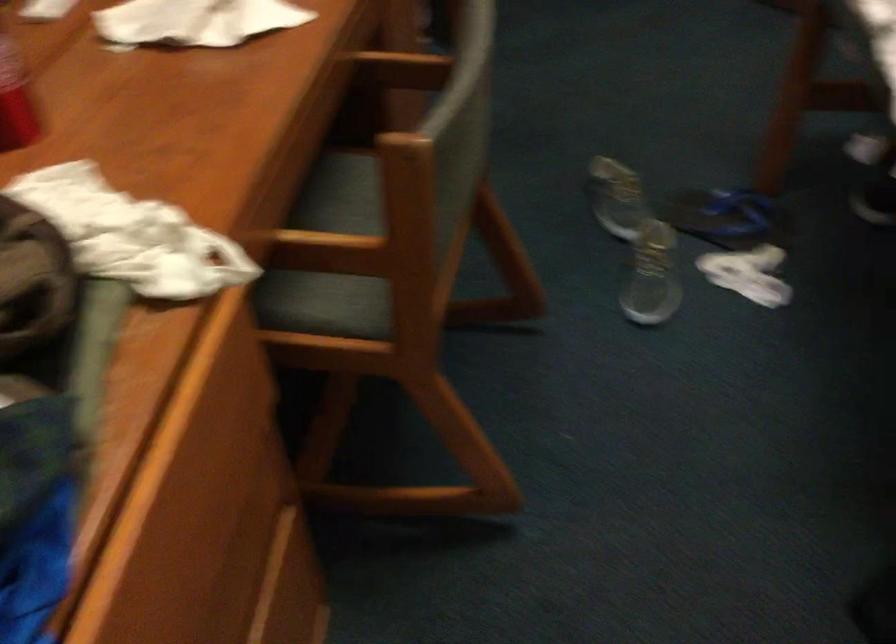
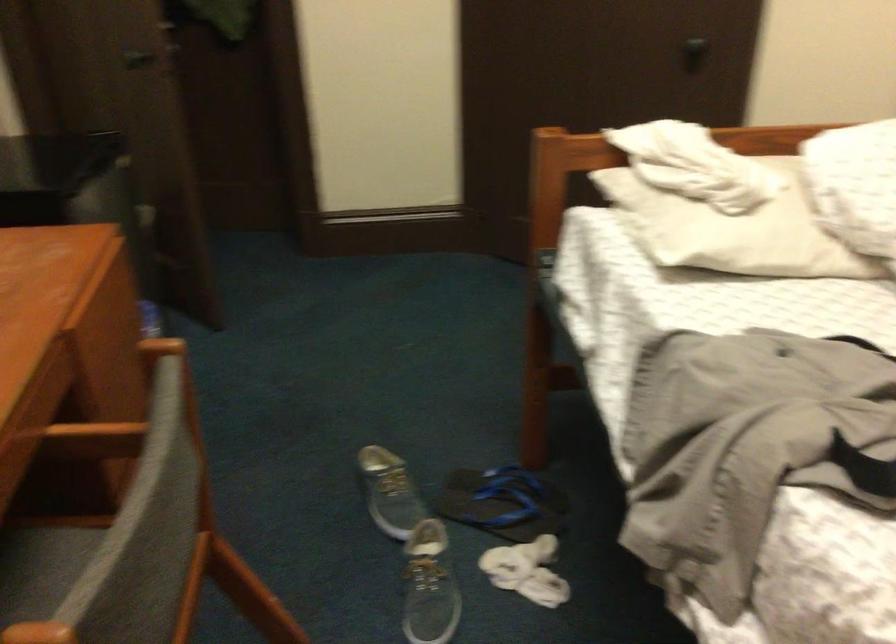
Question: The images are taken continuously from a first-person perspective. In which direction are you moving?

Choices:
 (A) Left
 (B) Right
 (C) Forward
 (D) Backward

Answer: (B)